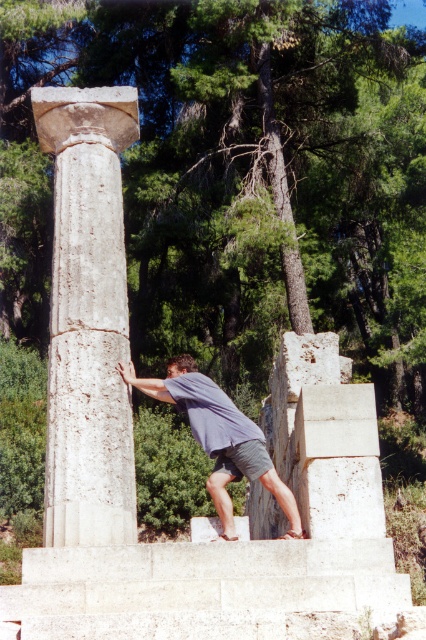
You are standing in an archaeological site and see the white marble column at left and the gray fabric shirt at center. Which object is closer to you?

The gray fabric shirt at center is closer to you because the white marble column at left is positioned over it, indicating that the column is behind the shirt.

You are a tour guide explaining the ancient ruins to visitors. You point out the white marble column at left and the gray fabric shirt at center. Which object is bigger in size?

The white marble column at left is larger in size than the gray fabric shirt at center.